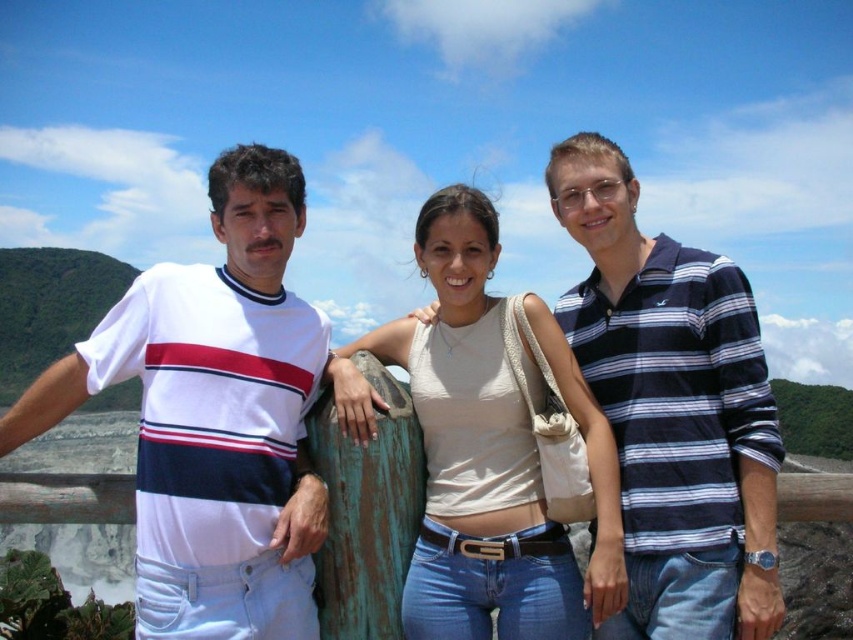
Question: Which point is farther to the camera?

Choices:
 (A) blue striped polo shirt at right
 (B) white striped t-shirt at left

Answer: (B)

Question: Which of the following is the closest to the observer?

Choices:
 (A) (293, 193)
 (B) (556, 148)

Answer: (A)

Question: Can you confirm if white striped t-shirt at left is positioned to the right of blue striped polo shirt at right?

Choices:
 (A) no
 (B) yes

Answer: (A)

Question: Can you confirm if beige fabric tank top at center is positioned to the right of white striped shirt at center?

Choices:
 (A) yes
 (B) no

Answer: (A)

Question: Observing the image, what is the correct spatial positioning of white striped t-shirt at left in reference to white striped shirt at center?

Choices:
 (A) above
 (B) below

Answer: (B)

Question: Considering the real-world distances, which object is farthest from the blue striped polo shirt at right?

Choices:
 (A) beige fabric tank top at center
 (B) white striped t-shirt at left

Answer: (B)